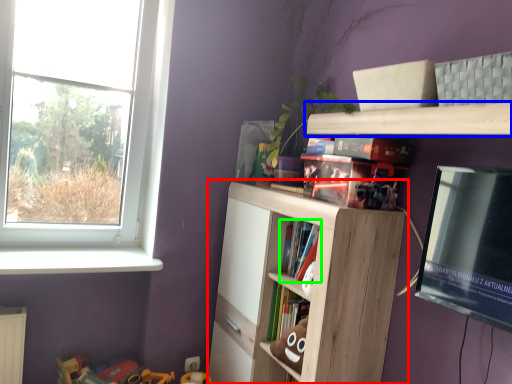
Question: Estimate the real-world distances between objects in this image. Which object is farther from shelf (highlighted by a red box), shelf (highlighted by a blue box) or book (highlighted by a green box)?

Choices:
 (A) shelf
 (B) book

Answer: (A)